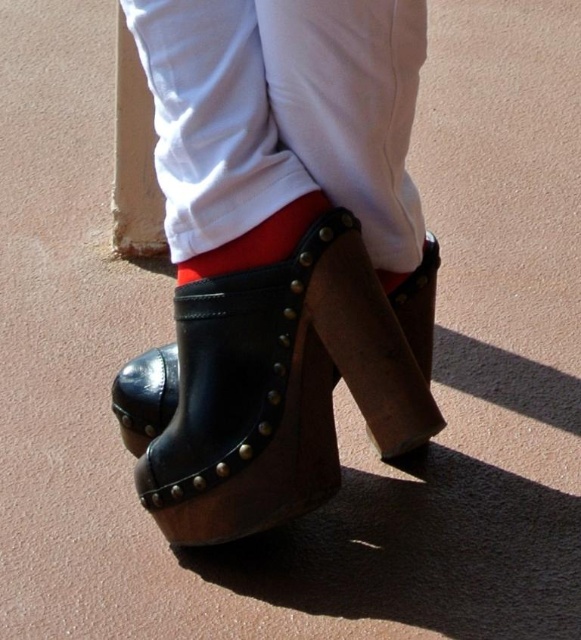
At what (x,y) coordinates should I click in order to perform the action: click on black leather sandal at center. Please return your answer as a coordinate pair (x, y). This screenshot has height=640, width=581. Looking at the image, I should click on (278, 385).

Between black leather sandal at center and red leather sock at center, which one appears on the left side from the viewer's perspective?

red leather sock at center is more to the left.

Which is behind, point (407, 310) or point (238, 244)?

The point (407, 310) is more distant.

What are the coordinates of `black leather sandal at center` in the screenshot? It's located at (278, 385).